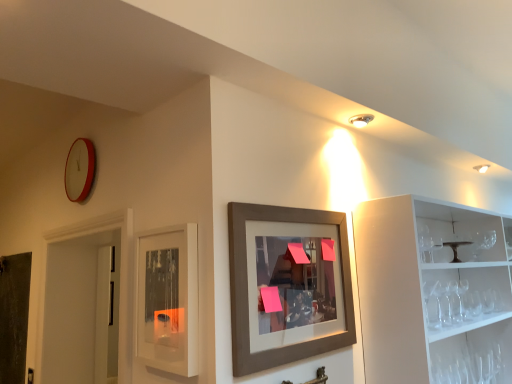
Question: Can you confirm if dark gray matte door at left is wider than matte glass cabinet at center?

Choices:
 (A) yes
 (B) no

Answer: (A)

Question: Can you confirm if dark gray matte door at left is bigger than matte glass cabinet at center?

Choices:
 (A) no
 (B) yes

Answer: (B)

Question: Are dark gray matte door at left and matte glass cabinet at center located far from each other?

Choices:
 (A) no
 (B) yes

Answer: (B)

Question: Is dark gray matte door at left turned away from matte glass cabinet at center?

Choices:
 (A) yes
 (B) no

Answer: (B)

Question: Considering the relative sizes of dark gray matte door at left and matte glass cabinet at center in the image provided, is dark gray matte door at left taller than matte glass cabinet at center?

Choices:
 (A) no
 (B) yes

Answer: (B)

Question: Does point (322, 377) appear closer or farther from the camera than point (161, 311)?

Choices:
 (A) farther
 (B) closer

Answer: (A)

Question: In terms of width, does metallic silver faucet at lower center look wider or thinner when compared to matte glass cabinet at center?

Choices:
 (A) thin
 (B) wide

Answer: (B)

Question: From the image's perspective, is metallic silver faucet at lower center above or below matte glass cabinet at center?

Choices:
 (A) above
 (B) below

Answer: (B)

Question: Visually, is metallic silver faucet at lower center positioned to the left or to the right of matte glass cabinet at center?

Choices:
 (A) right
 (B) left

Answer: (A)

Question: Relative to matte glass cabinet at center, is brown wooden picture frame at center in front or behind?

Choices:
 (A) behind
 (B) front

Answer: (B)

Question: From the image's perspective, is brown wooden picture frame at center positioned above or below matte glass cabinet at center?

Choices:
 (A) below
 (B) above

Answer: (B)

Question: In the image, is brown wooden picture frame at center on the left side or the right side of matte glass cabinet at center?

Choices:
 (A) left
 (B) right

Answer: (B)

Question: Is brown wooden picture frame at center inside the boundaries of matte glass cabinet at center, or outside?

Choices:
 (A) outside
 (B) inside

Answer: (A)

Question: From the image's perspective, is brown wooden picture frame at center above or below metallic dark brown cake stand at right?

Choices:
 (A) above
 (B) below

Answer: (B)

Question: From a real-world perspective, is brown wooden picture frame at center positioned above or below metallic dark brown cake stand at right?

Choices:
 (A) below
 (B) above

Answer: (A)